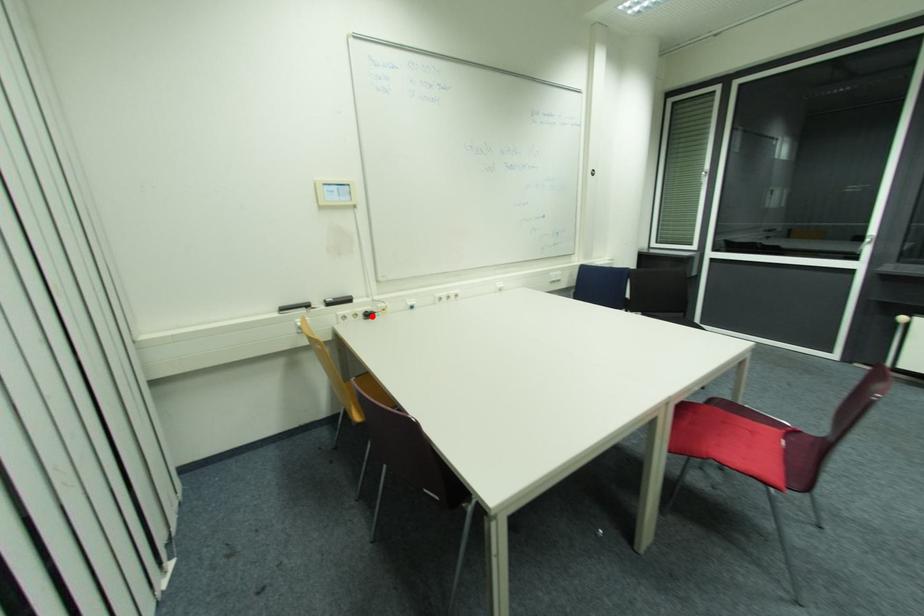
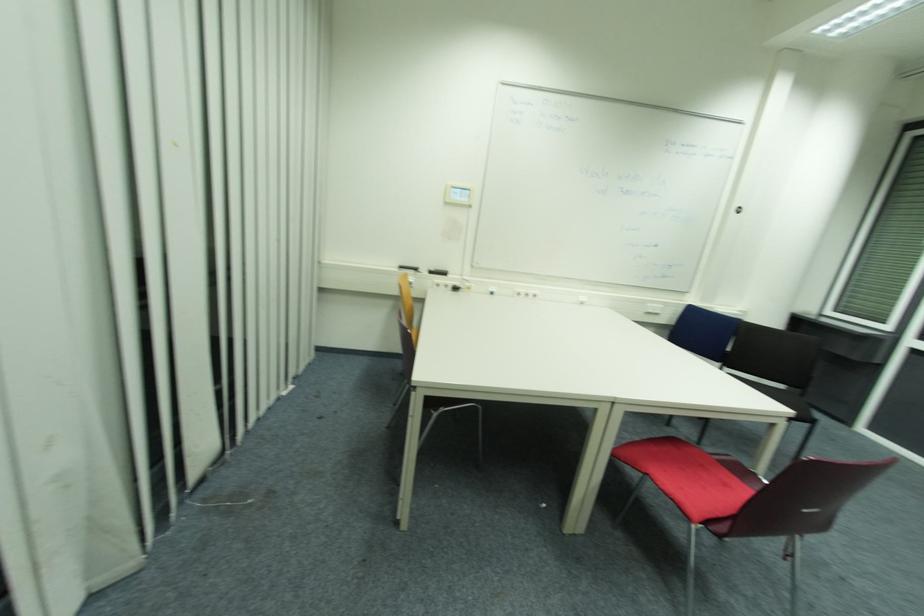
In the second image, find the point that corresponds to the highlighted location in the first image.

(458, 290)